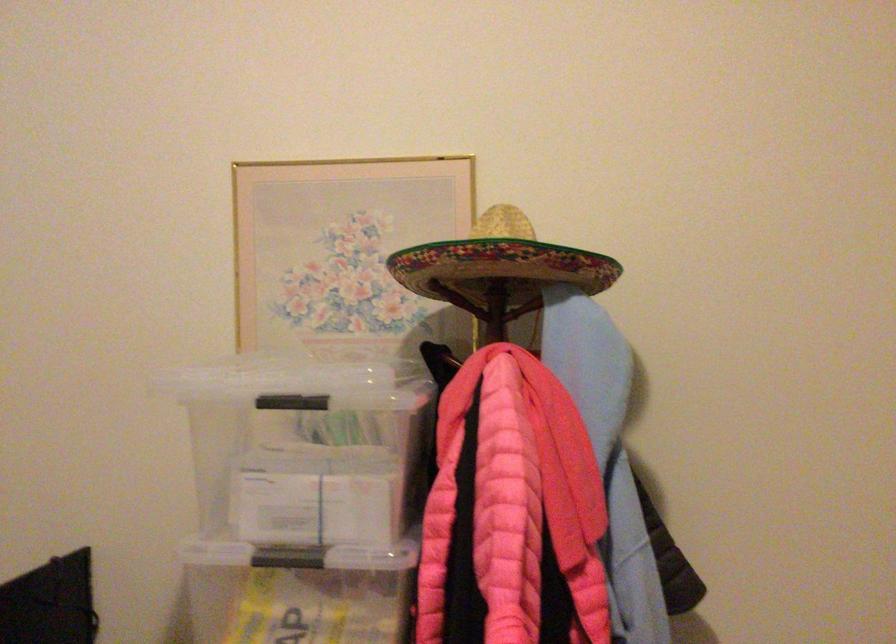
This screenshot has height=644, width=896. Describe the element at coordinates (498, 266) in the screenshot. I see `the straw sombrero hat` at that location.